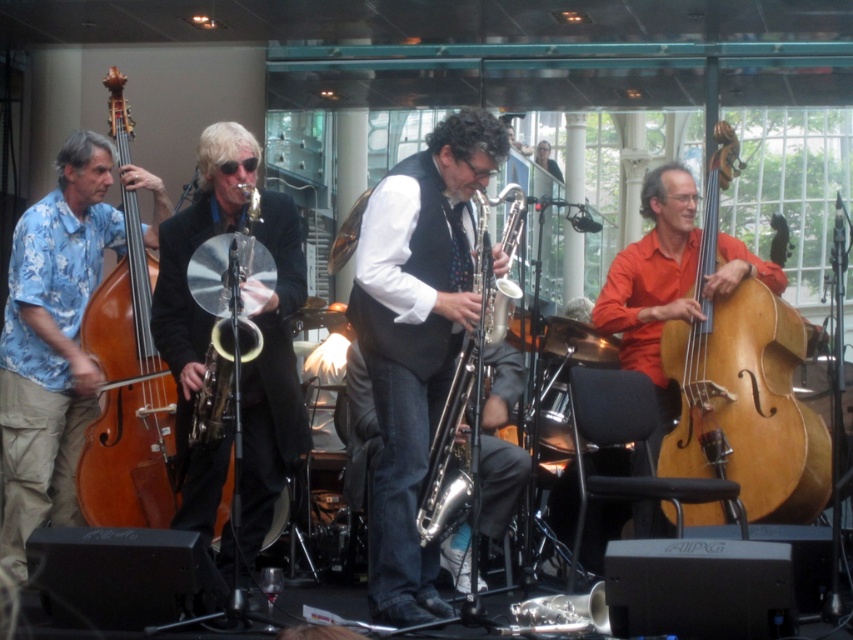
Question: Is black shiny suit at center positioned behind wooden polished cello at center?

Choices:
 (A) no
 (B) yes

Answer: (B)

Question: Which point is closer to the camera taking this photo?

Choices:
 (A) (206, 419)
 (B) (231, 474)

Answer: (A)

Question: Estimate the real-world distances between objects in this image. Which object is farther from the shiny silver saxophone at center?

Choices:
 (A) blue floral shirt at left
 (B) black shiny suit at center

Answer: (A)

Question: Which of the following is the farthest from the observer?

Choices:
 (A) blue floral shirt at left
 (B) natural wood cello at right

Answer: (A)

Question: Considering the relative positions of shiny silver saxophone at center and black shiny suit at center in the image provided, where is shiny silver saxophone at center located with respect to black shiny suit at center?

Choices:
 (A) above
 (B) below

Answer: (A)

Question: Does blue floral shirt at left appear on the left side of wooden polished cello at center?

Choices:
 (A) no
 (B) yes

Answer: (B)